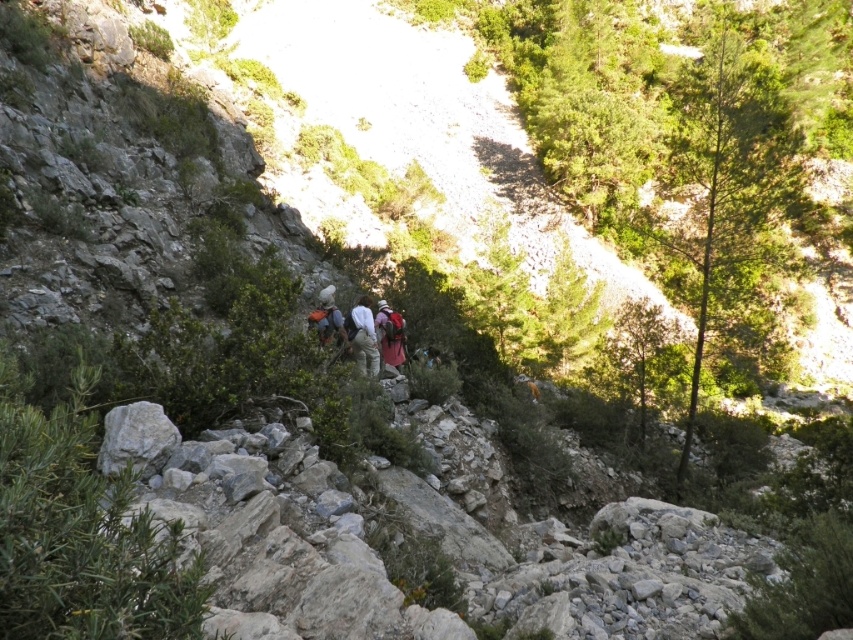
What do you see at coordinates (363, 337) in the screenshot? The width and height of the screenshot is (853, 640). I see `white fabric backpack at center` at bounding box center [363, 337].

Is white fabric backpack at center below matte orange backpack at center?

Correct, white fabric backpack at center is located below matte orange backpack at center.

Is point (372, 358) positioned in front of point (331, 314)?

That is False.

Where is `white fabric backpack at center`? white fabric backpack at center is located at coordinates (363, 337).

Which is behind, point (370, 349) or point (386, 349)?

Point (386, 349)

Which of these two, white fabric backpack at center or camouflage fabric backpack at center, stands taller?

white fabric backpack at center is taller.

Describe the element at coordinates (363, 337) in the screenshot. I see `white fabric backpack at center` at that location.

Locate an element on the screen. white fabric backpack at center is located at coordinates (363, 337).

The width and height of the screenshot is (853, 640). I want to click on camouflage fabric backpack at center, so click(x=390, y=333).

Find the location of a particular element. camouflage fabric backpack at center is located at coordinates pyautogui.click(x=390, y=333).